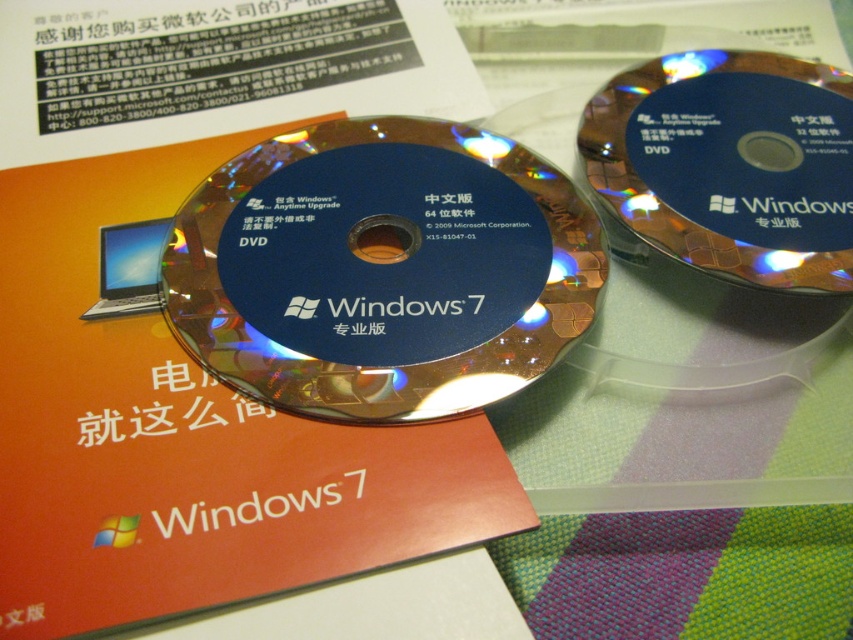
Question: Which object is closer to the camera taking this photo?

Choices:
 (A) blue glossy dvd at upper right
 (B) glossy blue dvd at center

Answer: (B)

Question: Among these points, which one is nearest to the camera?

Choices:
 (A) (186, 244)
 (B) (677, 221)

Answer: (A)

Question: Among these objects, which one is nearest to the camera?

Choices:
 (A) blue glossy dvd at upper right
 (B) glossy blue dvd at center

Answer: (B)

Question: Is glossy blue dvd at center positioned before blue glossy dvd at upper right?

Choices:
 (A) no
 (B) yes

Answer: (B)

Question: Can you confirm if glossy blue dvd at center is wider than blue glossy dvd at upper right?

Choices:
 (A) no
 (B) yes

Answer: (B)

Question: Does glossy blue dvd at center appear under blue glossy dvd at upper right?

Choices:
 (A) yes
 (B) no

Answer: (A)